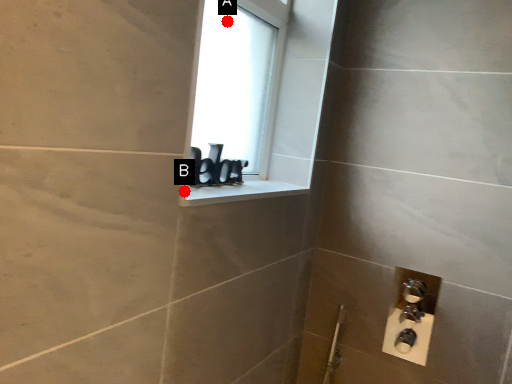
Question: Two points are circled on the image, labeled by A and B beside each circle. Which of the following is the farthest from the observer?

Choices:
 (A) A is further
 (B) B is further

Answer: (A)